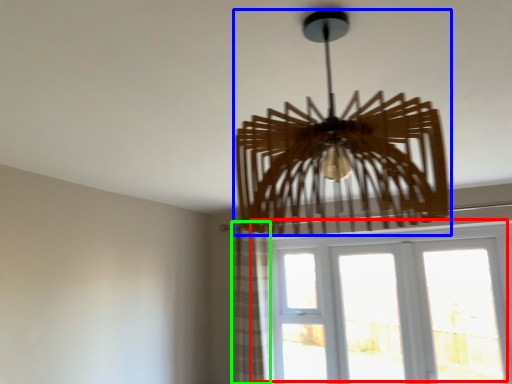
Question: Based on their relative distances, which object is nearer to window (highlighted by a red box)? Choose from lamp (highlighted by a blue box) and curtain (highlighted by a green box).

Choices:
 (A) lamp
 (B) curtain

Answer: (B)